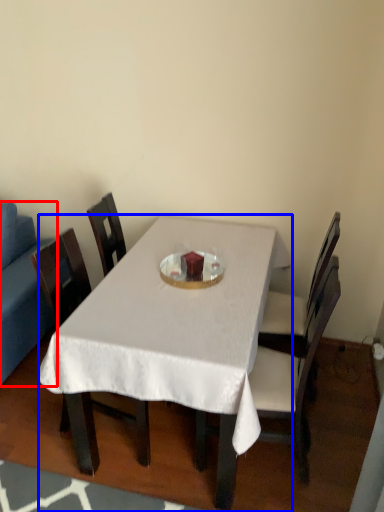
Question: Which point is further to the camera, studio couch (highlighted by a red box) or desk (highlighted by a blue box)?

Choices:
 (A) studio couch
 (B) desk

Answer: (A)